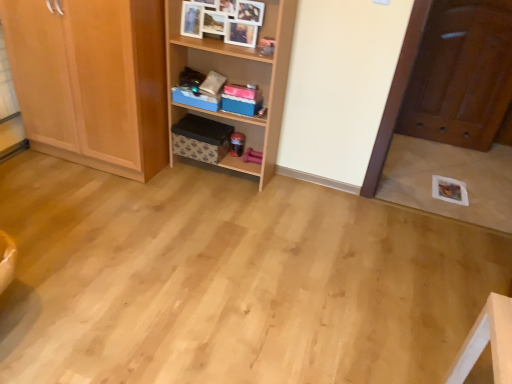
Locate an element on the screen. The height and width of the screenshot is (384, 512). free location in front of light wood cabinet at left is located at coordinates (84, 206).